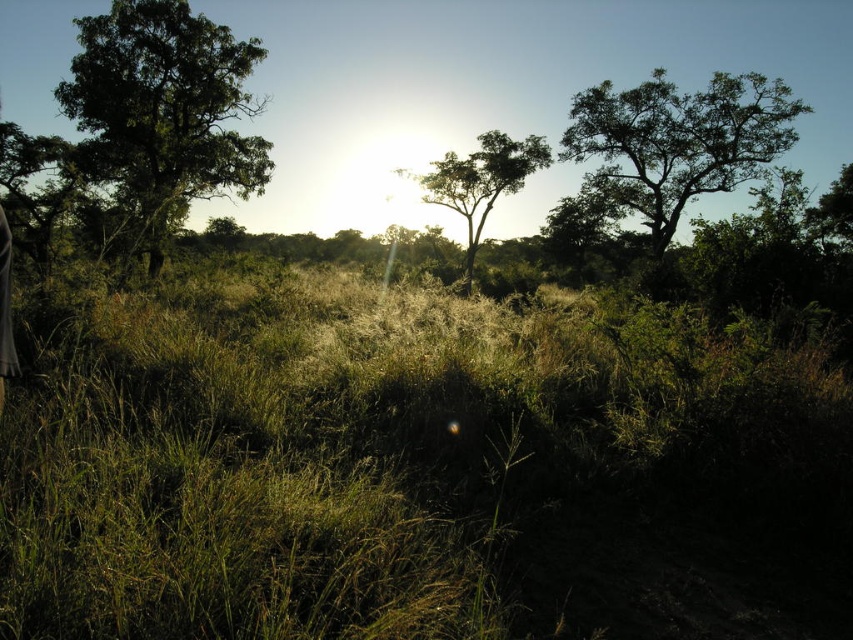
You are a photographer trying to capture the perfect shot of the green leafy tree at upper right. Based on the scene description, where should you position your camera to ensure the tree is centered in your frame?

To center the green leafy tree at upper right in your frame, position your camera so that the tree is located at the coordinates specified by the point (676, 141) in the image plane. This ensures the tree is precisely centered according to its 2D location.

You are standing in the middle of the green grass at center and looking towards the green leafy tree at upper right. Which direction should you walk to get closer to the tree?

You should walk towards the upper right direction to get closer to the green leafy tree at upper right since it is located above and to the right of the green grass at center.